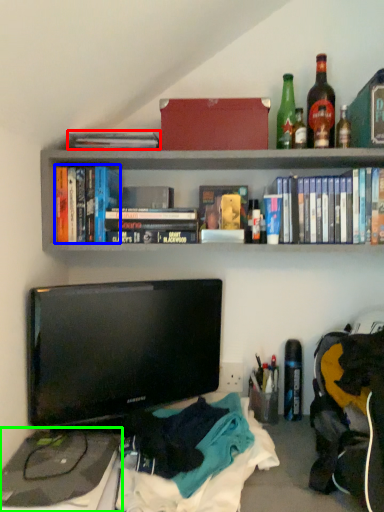
Question: Which object is positioned closest to book (highlighted by a red box)? Select from book (highlighted by a blue box) and desktop (highlighted by a green box).

Choices:
 (A) book
 (B) desktop

Answer: (A)